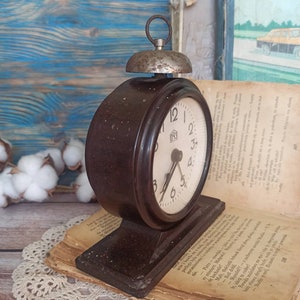
Find the location of a particular element. Image resolution: width=300 pixels, height=300 pixels. wall is located at coordinates (70, 60).